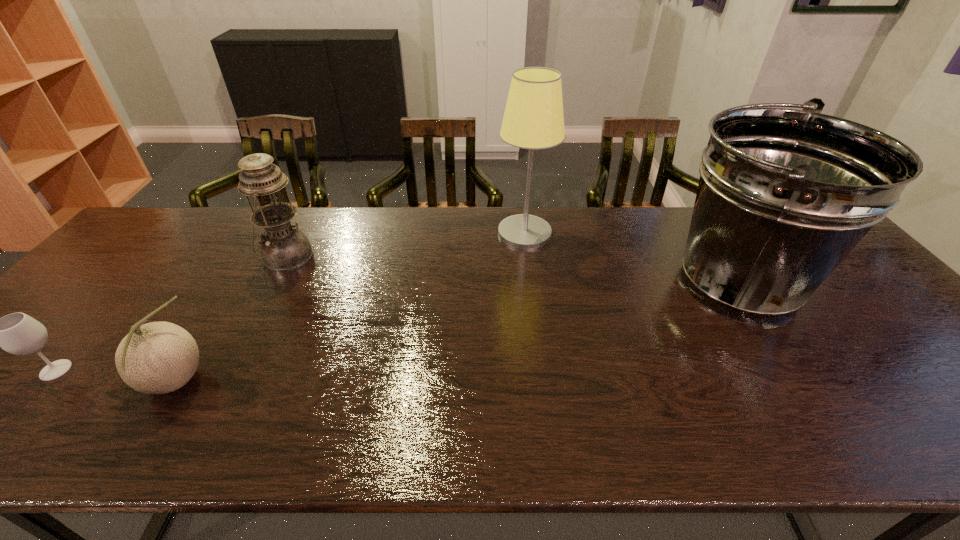
I want to click on vacant space that satisfies the following two spatial constraints: 1. on the back side of the wineglass; 2. on the left side of the third tallest object, so click(x=156, y=258).

In order to click on free space that satisfies the following two spatial constraints: 1. on the back side of the shortest object; 2. on the right side of the oil lamp in this screenshot , I will do `click(156, 258)`.